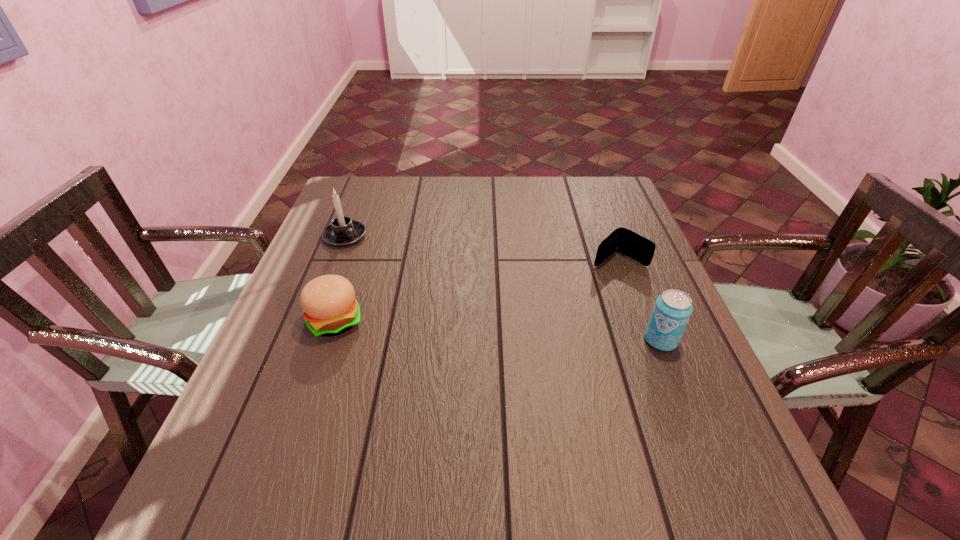
Image resolution: width=960 pixels, height=540 pixels. I want to click on vacant space situated with a handle on the side of the tallest object, so click(x=430, y=304).

Identify the location of free space located 0.210m on the outer surface of the shortest object. (551, 307).

Identify the location of vacant region located 0.190m on the outer surface of the shortest object. Image resolution: width=960 pixels, height=540 pixels. (557, 303).

Identify the location of free region located on the outer surface of the shortest object. (499, 349).

Identify the location of hamburger located at the left edge. The height and width of the screenshot is (540, 960). (330, 308).

Locate an element on the screen. candle holder that is at the left edge is located at coordinates (343, 231).

In order to click on beer can that is at the right edge in this screenshot , I will do `click(672, 310)`.

Identify the location of wallet located in the right edge section of the desktop. (622, 240).

Where is `vacant region at the far edge of the desktop`? vacant region at the far edge of the desktop is located at coordinates (496, 201).

Identify the location of vacant space at the near edge. (539, 435).